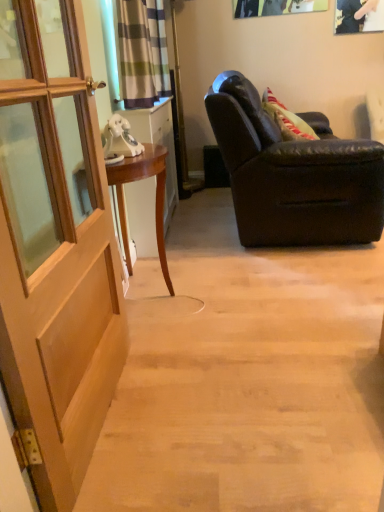
What is the approximate width of striped fabric curtain at upper center?

striped fabric curtain at upper center is 5.66 inches wide.

Find the location of a particular element. The width and height of the screenshot is (384, 512). metallic silver picture frame at upper right is located at coordinates (359, 16).

What do you see at coordinates (294, 175) in the screenshot? I see `matte black leather armchair at right` at bounding box center [294, 175].

At what (x,y) coordinates should I click in order to perform the action: click on mahogany wood desk at left. Please return your answer as a coordinate pair (x, y). The width and height of the screenshot is (384, 512). Looking at the image, I should click on (155, 201).

What do you see at coordinates (287, 119) in the screenshot? I see `velvet-like green pillow at right` at bounding box center [287, 119].

Locate an element on the screen. Image resolution: width=384 pixels, height=512 pixels. striped fabric curtain at upper center is located at coordinates (141, 52).

Is striped fabric curtain at upper center not near velvet-like green pillow at right?

striped fabric curtain at upper center is near velvet-like green pillow at right, not far away.

Between striped fabric curtain at upper center and velvet-like green pillow at right, which one has larger width?

velvet-like green pillow at right.

How many degrees apart are the facing directions of striped fabric curtain at upper center and velvet-like green pillow at right?

36.7 degrees.

At what (x,y) coordinates should I click in order to perform the action: click on curtain that is on the left side of velvet-like green pillow at right. Please return your answer as a coordinate pair (x, y). This screenshot has height=512, width=384. Looking at the image, I should click on (141, 52).

Is mahogany wood desk at left smaller than matte black leather armchair at right?

Correct, mahogany wood desk at left occupies less space than matte black leather armchair at right.

What's the angular difference between mahogany wood desk at left and matte black leather armchair at right's facing directions?

2.11 degrees.

Who is taller, mahogany wood desk at left or matte black leather armchair at right?

matte black leather armchair at right is taller.

Does point (126, 226) come behind point (324, 218)?

No, it is not.

Is mahogany wood desk at left situated inside metallic silver picture frame at upper right or outside?

mahogany wood desk at left cannot be found inside metallic silver picture frame at upper right.

Who is taller, mahogany wood desk at left or metallic silver picture frame at upper right?

mahogany wood desk at left.

From the image's perspective, relative to metallic silver picture frame at upper right, is mahogany wood desk at left above or below?

mahogany wood desk at left is below metallic silver picture frame at upper right.

Considering the points (158, 161) and (376, 0), which point is in front, point (158, 161) or point (376, 0)?

The point (158, 161) is closer to the camera.

Between matte white cabinet at left and mahogany wood desk at left, which one has smaller width?

With smaller width is matte white cabinet at left.

Can you tell me how much matte white cabinet at left and mahogany wood desk at left differ in facing direction?

They differ by 1.86 degrees in their facing directions.

Is matte white cabinet at left beside mahogany wood desk at left?

No, matte white cabinet at left is not making contact with mahogany wood desk at left.

Is matte white cabinet at left to the right of mahogany wood desk at left from the viewer's perspective?

No.

Identify the location of door above the matte white cabinet at left (from a real-world perspective). (55, 248).

Is light brown wood door at left facing away from matte white cabinet at left?

No.

Is matte black leather armchair at right in contact with velvet-like green pillow at right?

No, matte black leather armchair at right is not with velvet-like green pillow at right.

Is velvet-like green pillow at right at the back of matte black leather armchair at right?

That's right, matte black leather armchair at right is facing away from velvet-like green pillow at right.

In the scene shown: Is matte black leather armchair at right closer to camera compared to velvet-like green pillow at right?

Yes, matte black leather armchair at right is closer to the camera.

Can you confirm if mahogany wood desk at left is shorter than velvet-like green pillow at right?

No.

Find the location of a particular element. The height and width of the screenshot is (512, 384). desk below the velvet-like green pillow at right (from a real-world perspective) is located at coordinates (155, 201).

From a real-world perspective, which is physically above, mahogany wood desk at left or velvet-like green pillow at right?

From a 3D spatial view, velvet-like green pillow at right is above.

Can we say mahogany wood desk at left lies outside velvet-like green pillow at right?

Yes, mahogany wood desk at left is not within velvet-like green pillow at right.

The width and height of the screenshot is (384, 512). I want to click on curtain located above the velvet-like green pillow at right (from the image's perspective), so click(141, 52).

Identify the location of chair on the right of mahogany wood desk at left. (294, 175).

Which object lies further to the anchor point light brown wood door at left, velvet-like green pillow at right or matte white cabinet at left?

Based on the image, velvet-like green pillow at right appears to be further to light brown wood door at left.

In the scene shown: From the image, which object appears to be nearer to light brown wood door at left, velvet-like green pillow at right or matte black leather armchair at right?

matte black leather armchair at right.

When comparing their distances from light brown wood door at left, does mahogany wood desk at left or striped fabric curtain at upper center seem further?

striped fabric curtain at upper center lies further to light brown wood door at left than the other object.

Considering their positions, is light brown wood door at left positioned further to metallic silver picture frame at upper right than mahogany wood desk at left?

The object further to metallic silver picture frame at upper right is light brown wood door at left.

Considering their positions, is striped fabric curtain at upper center positioned further to velvet-like green pillow at right than matte black leather armchair at right?

striped fabric curtain at upper center lies further to velvet-like green pillow at right than the other object.

When comparing their distances from metallic silver picture frame at upper right, does striped fabric curtain at upper center or mahogany wood desk at left seem closer?

The object closer to metallic silver picture frame at upper right is striped fabric curtain at upper center.

Consider the image. Based on their spatial positions, is striped fabric curtain at upper center or mahogany wood desk at left further from velvet-like green pillow at right?

mahogany wood desk at left is positioned further to the anchor velvet-like green pillow at right.

When comparing their distances from light brown wood door at left, does matte black leather armchair at right or matte white cabinet at left seem further?

matte black leather armchair at right lies further to light brown wood door at left than the other object.

Where is `cabinetry that lies between striped fabric curtain at upper center and mahogany wood desk at left from top to bottom`? The width and height of the screenshot is (384, 512). cabinetry that lies between striped fabric curtain at upper center and mahogany wood desk at left from top to bottom is located at coordinates (158, 144).

I want to click on chair between light brown wood door at left and metallic silver picture frame at upper right along the z-axis, so click(x=294, y=175).

This screenshot has width=384, height=512. I want to click on pillow between matte white cabinet at left and metallic silver picture frame at upper right from left to right, so click(287, 119).

Locate an element on the screen. Image resolution: width=384 pixels, height=512 pixels. cabinetry between striped fabric curtain at upper center and velvet-like green pillow at right from left to right is located at coordinates (158, 144).